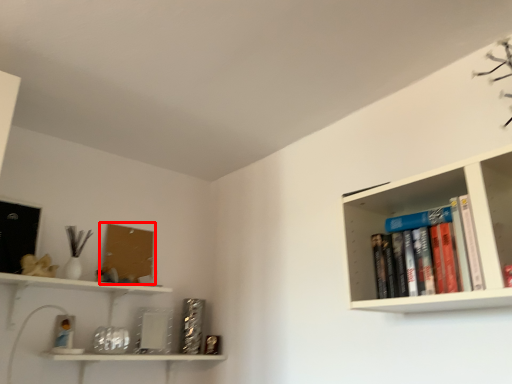
Question: Observing the image, what is the correct spatial positioning of book cover (annotated by the red box) in reference to book?

Choices:
 (A) right
 (B) left

Answer: (B)